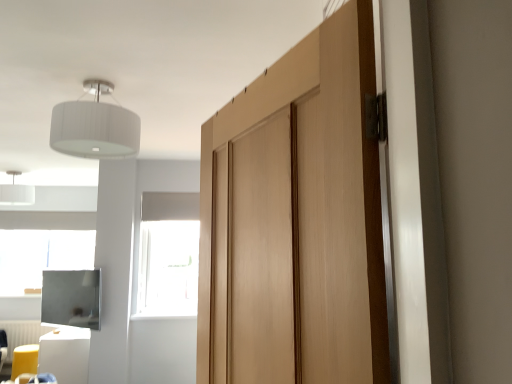
Question: Is white fabric lampshade at upper left, marked as the second light fixture in a top-to-bottom arrangement, located within transparent glass window at center?

Choices:
 (A) no
 (B) yes

Answer: (A)

Question: From a real-world perspective, is transparent glass window at center located beneath white fabric lampshade at upper left, which is the second light fixture from front to back?

Choices:
 (A) yes
 (B) no

Answer: (A)

Question: Is transparent glass window at center taller than white fabric lampshade at upper left, marked as the second light fixture in a top-to-bottom arrangement?

Choices:
 (A) no
 (B) yes

Answer: (B)

Question: Can you confirm if transparent glass window at center is smaller than white fabric lampshade at upper left, which ranks as the first light fixture in left-to-right order?

Choices:
 (A) no
 (B) yes

Answer: (B)

Question: Is transparent glass window at center to the right of white fabric lampshade at upper left, which ranks as the first light fixture in left-to-right order, from the viewer's perspective?

Choices:
 (A) yes
 (B) no

Answer: (A)

Question: Is yellow fabric stool at lower left, acting as the 1th furniture starting from the left, inside or outside of white plastic radiator at lower left?

Choices:
 (A) inside
 (B) outside

Answer: (B)

Question: From a real-world perspective, is yellow fabric stool at lower left, the second furniture in the right-to-left sequence, above or below white plastic radiator at lower left?

Choices:
 (A) above
 (B) below

Answer: (B)

Question: From their relative heights in the image, would you say yellow fabric stool at lower left, the second furniture in the right-to-left sequence, is taller or shorter than white plastic radiator at lower left?

Choices:
 (A) tall
 (B) short

Answer: (B)

Question: Considering the positions of yellow fabric stool at lower left, marked as the 1th furniture in a back-to-front arrangement, and white plastic radiator at lower left in the image, is yellow fabric stool at lower left, marked as the 1th furniture in a back-to-front arrangement, wider or thinner than white plastic radiator at lower left?

Choices:
 (A) thin
 (B) wide

Answer: (B)

Question: Do you think white fabric lampshade at upper left, acting as the first light fixture starting from the bottom, is within matte black screen at lower left, or outside of it?

Choices:
 (A) outside
 (B) inside

Answer: (A)

Question: From a real-world perspective, is white fabric lampshade at upper left, which ranks as the first light fixture in left-to-right order, physically located above or below matte black screen at lower left?

Choices:
 (A) below
 (B) above

Answer: (B)

Question: Would you say white fabric lampshade at upper left, placed as the second light fixture when sorted from right to left, is to the left or to the right of matte black screen at lower left in the picture?

Choices:
 (A) left
 (B) right

Answer: (A)

Question: Is white fabric lampshade at upper left, acting as the first light fixture starting from the bottom, wider or thinner than matte black screen at lower left?

Choices:
 (A) wide
 (B) thin

Answer: (A)

Question: From a real-world perspective, relative to white plastic radiator at lower left, is white fabric lampshade at upper left, which is counted as the 2th light fixture, starting from the bottom, vertically above or below?

Choices:
 (A) below
 (B) above

Answer: (B)

Question: Is white fabric lampshade at upper left, the 1th light fixture when ordered from right to left, taller or shorter than white plastic radiator at lower left?

Choices:
 (A) short
 (B) tall

Answer: (A)